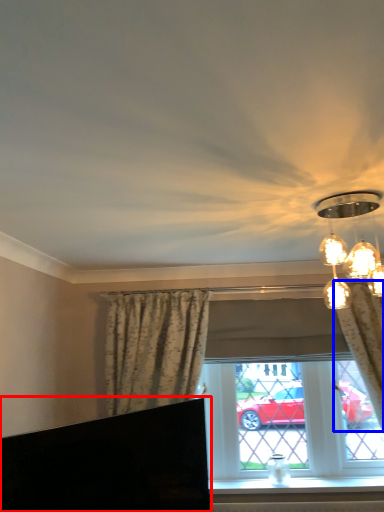
Question: Which object appears farthest to the camera in this image, furniture (highlighted by a red box) or curtain (highlighted by a blue box)?

Choices:
 (A) furniture
 (B) curtain

Answer: (B)